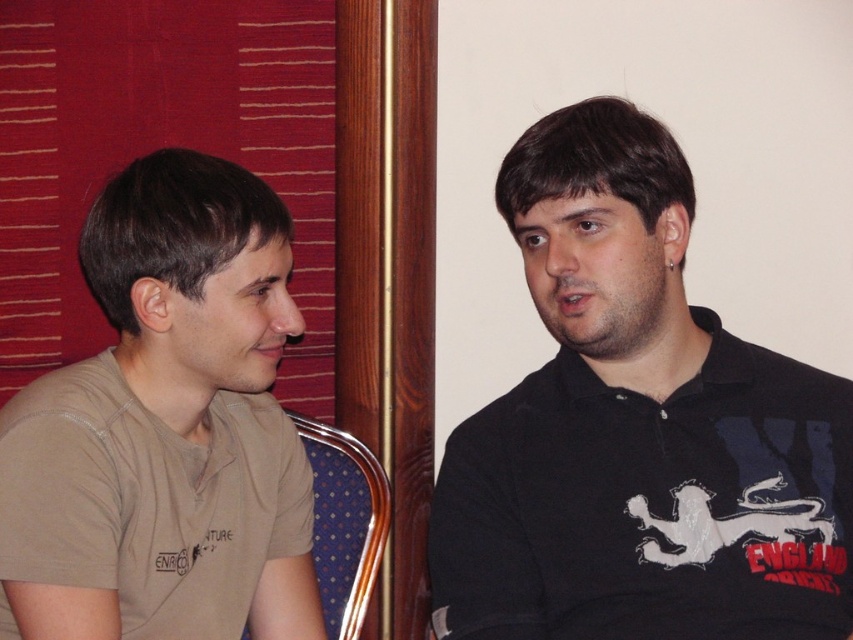
Does point (787, 484) come closer to viewer compared to point (91, 525)?

No, (787, 484) is behind (91, 525).

Between black matte shirt at right and beige cotton t-shirt at left, which one appears on the left side from the viewer's perspective?

From the viewer's perspective, beige cotton t-shirt at left appears more on the left side.

This screenshot has width=853, height=640. Identify the location of black matte shirt at right. (637, 429).

Between black matte shirt at right and blue fabric chair at left, which one is positioned higher?

black matte shirt at right is above.

In the scene shown: Can you confirm if black matte shirt at right is bigger than blue fabric chair at left?

Indeed, black matte shirt at right has a larger size compared to blue fabric chair at left.

This screenshot has width=853, height=640. Describe the element at coordinates (637, 429) in the screenshot. I see `black matte shirt at right` at that location.

You are a GUI agent. You are given a task and a screenshot of the screen. Output one action in this format:
    pyautogui.click(x=<x>, y=<y>)
    Task: Click on the black matte shirt at right
    The width and height of the screenshot is (853, 640).
    Given the screenshot: What is the action you would take?
    pyautogui.click(x=637, y=429)

Can you confirm if beige cotton t-shirt at left is positioned to the left of blue fabric chair at left?

Indeed, beige cotton t-shirt at left is positioned on the left side of blue fabric chair at left.

Which is in front, point (296, 515) or point (331, 534)?

Point (296, 515) is more forward.

Identify the location of beige cotton t-shirt at left. This screenshot has width=853, height=640. [x=161, y=417].